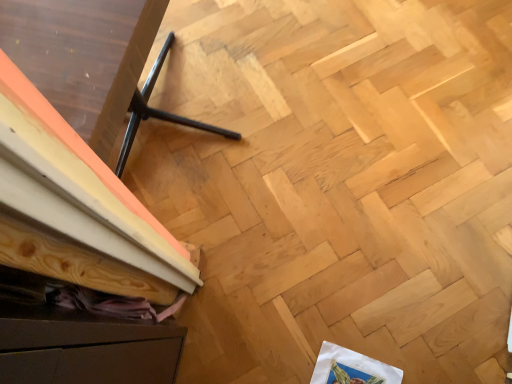
Identify the location of black metal tripod at lower left. The height and width of the screenshot is (384, 512). (77, 154).

Where is `wrapping paper on the right of the brown matte drawer at lower left`? wrapping paper on the right of the brown matte drawer at lower left is located at coordinates (351, 368).

Between brown matte drawer at lower left and white paper at lower right, which one has larger size?

brown matte drawer at lower left is bigger.

Who is more distant, brown matte drawer at lower left or white paper at lower right?

white paper at lower right is further from the camera.

Is brown matte drawer at lower left positioned with its back to white paper at lower right?

No.

Looking at this image, is white paper at lower right surrounded by black metal tripod at lower left?

No, white paper at lower right is not a part of black metal tripod at lower left.

Considering the positions of point (89, 58) and point (373, 362), is point (89, 58) closer or farther from the camera than point (373, 362)?

Point (89, 58) appears to be closer to the viewer than point (373, 362).

Is black metal tripod at lower left thinner than white paper at lower right?

No.

Which object is more forward, black metal tripod at lower left or white paper at lower right?

black metal tripod at lower left is in front.

In terms of height, does black metal tripod at lower left look taller or shorter compared to brown matte drawer at lower left?

In the image, black metal tripod at lower left appears to be shorter than brown matte drawer at lower left.

At what (x,y) coordinates should I click in order to perform the action: click on furniture on the left of the brown matte drawer at lower left. Please return your answer as a coordinate pair (x, y). Looking at the image, I should click on (77, 154).

Is black metal tripod at lower left beside brown matte drawer at lower left?

No, black metal tripod at lower left is not next to brown matte drawer at lower left.

Between white paper at lower right and black metal tripod at lower left, which one has larger size?

black metal tripod at lower left is bigger.

Considering the points (371, 367) and (48, 323), which point is in front, point (371, 367) or point (48, 323)?

Point (48, 323)

How many degrees apart are the facing directions of white paper at lower right and black metal tripod at lower left?

white paper at lower right and black metal tripod at lower left are facing 6.16 degrees away from each other.

Is black metal tripod at lower left completely or partially inside white paper at lower right?

No, black metal tripod at lower left is not a part of white paper at lower right.

Is white paper at lower right inside or outside of brown matte drawer at lower left?

white paper at lower right cannot be found inside brown matte drawer at lower left.

From the image's perspective, which is above, white paper at lower right or brown matte drawer at lower left?

brown matte drawer at lower left appears higher in the image.

From a real-world perspective, is white paper at lower right on top of brown matte drawer at lower left?

No, from a real-world perspective, white paper at lower right is not above brown matte drawer at lower left.

Does white paper at lower right come in front of brown matte drawer at lower left?

No, the depth of white paper at lower right is greater than that of brown matte drawer at lower left.

Would you say brown matte drawer at lower left contains black metal tripod at lower left?

No, black metal tripod at lower left is not a part of brown matte drawer at lower left.

In the image, is brown matte drawer at lower left on the left side or the right side of black metal tripod at lower left?

In the image, brown matte drawer at lower left appears on the right side of black metal tripod at lower left.

From the image's perspective, is brown matte drawer at lower left positioned above or below black metal tripod at lower left?

Clearly, from the image's perspective, brown matte drawer at lower left is below black metal tripod at lower left.

Locate an element on the screen. The width and height of the screenshot is (512, 384). drawer in front of the white paper at lower right is located at coordinates tap(88, 352).

Where is `furniture that appears above the white paper at lower right (from the image's perspective)`? This screenshot has height=384, width=512. furniture that appears above the white paper at lower right (from the image's perspective) is located at coordinates (77, 154).

Based on their spatial positions, is black metal tripod at lower left or white paper at lower right closer to brown matte drawer at lower left?

The object closer to brown matte drawer at lower left is black metal tripod at lower left.

From the picture: Looking at the image, which one is located closer to brown matte drawer at lower left, white paper at lower right or black metal tripod at lower left?

black metal tripod at lower left is closer to brown matte drawer at lower left.

When comparing their distances from white paper at lower right, does black metal tripod at lower left or brown matte drawer at lower left seem closer?

brown matte drawer at lower left is positioned closer to the anchor white paper at lower right.

Considering their positions, is brown matte drawer at lower left positioned closer to black metal tripod at lower left than white paper at lower right?

brown matte drawer at lower left.

Which object lies nearer to the anchor point black metal tripod at lower left, white paper at lower right or brown matte drawer at lower left?

The object closer to black metal tripod at lower left is brown matte drawer at lower left.

Estimate the real-world distances between objects in this image. Which object is further from white paper at lower right, brown matte drawer at lower left or black metal tripod at lower left?

black metal tripod at lower left is positioned further to the anchor white paper at lower right.

Locate an element on the screen. The height and width of the screenshot is (384, 512). drawer between black metal tripod at lower left and white paper at lower right vertically is located at coordinates (88, 352).